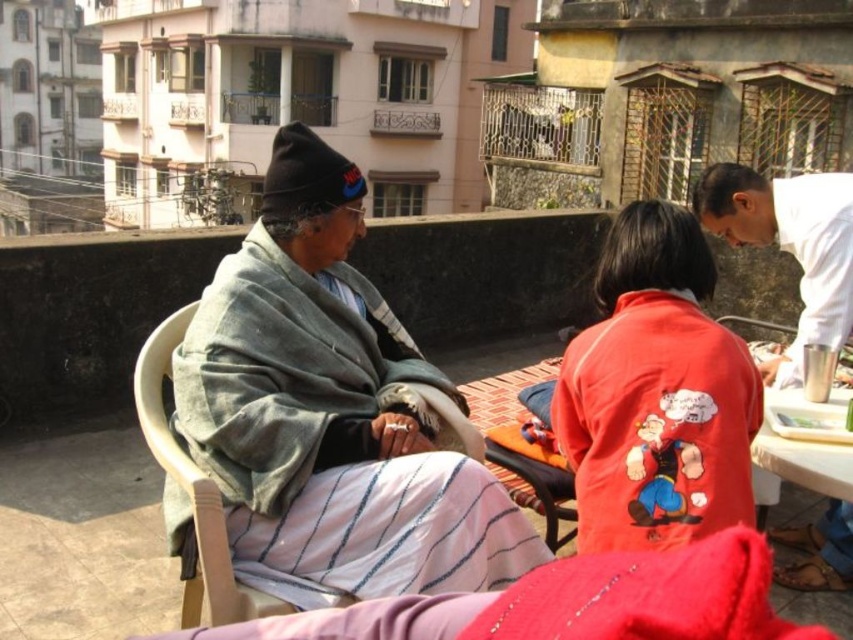
Image resolution: width=853 pixels, height=640 pixels. Describe the element at coordinates (329, 412) in the screenshot. I see `gray woolen shawl at left` at that location.

Does point (316, 394) come farther from viewer compared to point (138, 355)?

No, it is not.

I want to click on gray woolen shawl at left, so click(x=329, y=412).

Based on the photo, does gray woolen shawl at left have a larger size compared to white fabric shirt at right?

No, gray woolen shawl at left is not bigger than white fabric shirt at right.

Is point (341, 288) in front of point (831, 216)?

Yes, it is.

Identify the location of gray woolen shawl at left. (329, 412).

Does red matte jacket at center appear under wooden chair at center?

Incorrect, red matte jacket at center is not positioned below wooden chair at center.

Is point (654, 253) closer to viewer compared to point (177, 316)?

That is True.

Which is behind, point (616, 419) or point (201, 557)?

Point (616, 419)

This screenshot has width=853, height=640. What are the coordinates of `red matte jacket at center` in the screenshot? It's located at point(656,394).